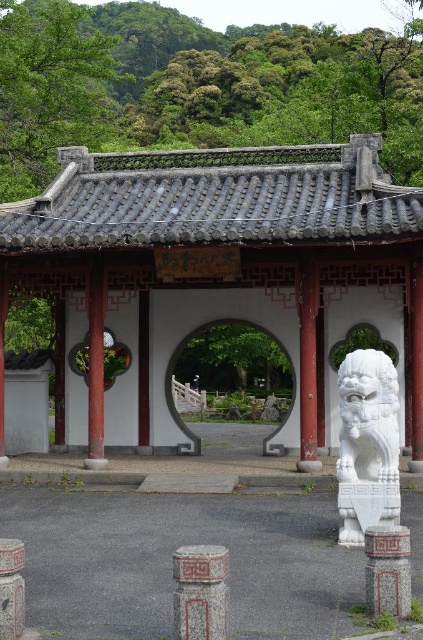
Who is lower down, white stone gazebo at center or white stone archway at center?

Positioned lower is white stone archway at center.

Between point (156, 429) and point (263, 444), which one is positioned in front?

Point (263, 444)

The width and height of the screenshot is (423, 640). I want to click on white stone gazebo at center, so click(x=219, y=276).

Which is more to the right, white marble lion at right or smooth gray stone pillar at lower left?

white marble lion at right

You are a GUI agent. You are given a task and a screenshot of the screen. Output one action in this format:
    pyautogui.click(x=<x>, y=<y>)
    Task: Click on the white marble lion at right
    This screenshot has height=640, width=423.
    Given the screenshot: What is the action you would take?
    pyautogui.click(x=367, y=444)

Consider the image. Is white marble lion at right closer to the viewer compared to carved stone pillar at center?

No, white marble lion at right is further to the viewer.

Image resolution: width=423 pixels, height=640 pixels. I want to click on white marble lion at right, so click(367, 444).

Locate an element on the screen. This screenshot has height=640, width=423. white marble lion at right is located at coordinates (367, 444).